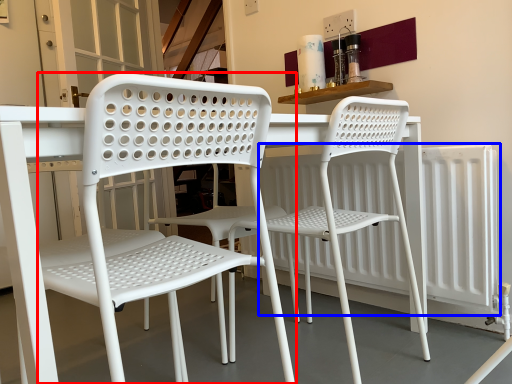
Question: Which object is closer to the camera taking this photo, chair (highlighted by a red box) or radiator (highlighted by a blue box)?

Choices:
 (A) chair
 (B) radiator

Answer: (A)